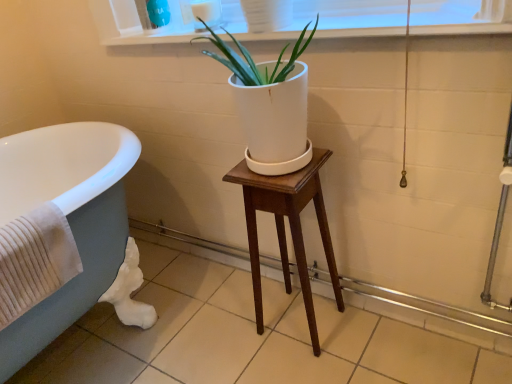
Question: Is mahogany wood stool at center positioned beyond the bounds of white glossy window sill at upper center?

Choices:
 (A) yes
 (B) no

Answer: (A)

Question: From a real-world perspective, is mahogany wood stool at center located higher than white glossy window sill at upper center?

Choices:
 (A) yes
 (B) no

Answer: (B)

Question: Does mahogany wood stool at center have a smaller size compared to white glossy window sill at upper center?

Choices:
 (A) no
 (B) yes

Answer: (A)

Question: Is mahogany wood stool at center placed right next to white glossy window sill at upper center?

Choices:
 (A) yes
 (B) no

Answer: (B)

Question: Is mahogany wood stool at center at the left side of white glossy window sill at upper center?

Choices:
 (A) yes
 (B) no

Answer: (B)

Question: Does mahogany wood stool at center have a lesser height compared to white glossy window sill at upper center?

Choices:
 (A) no
 (B) yes

Answer: (A)

Question: Does white matte pot at center appear on the right side of matte gray tub at left?

Choices:
 (A) yes
 (B) no

Answer: (A)

Question: Considering the relative positions of white matte pot at center and matte gray tub at left in the image provided, is white matte pot at center behind matte gray tub at left?

Choices:
 (A) no
 (B) yes

Answer: (A)

Question: Is matte gray tub at left surrounded by white matte pot at center?

Choices:
 (A) no
 (B) yes

Answer: (A)

Question: From a real-world perspective, does white matte pot at center stand above matte gray tub at left?

Choices:
 (A) yes
 (B) no

Answer: (A)

Question: Is there a large distance between white matte pot at center and matte gray tub at left?

Choices:
 (A) yes
 (B) no

Answer: (B)

Question: From a real-world perspective, is white matte pot at center beneath matte gray tub at left?

Choices:
 (A) yes
 (B) no

Answer: (B)

Question: Considering the relative sizes of matte gray tub at left and white glossy window sill at upper center in the image provided, is matte gray tub at left taller than white glossy window sill at upper center?

Choices:
 (A) no
 (B) yes

Answer: (B)